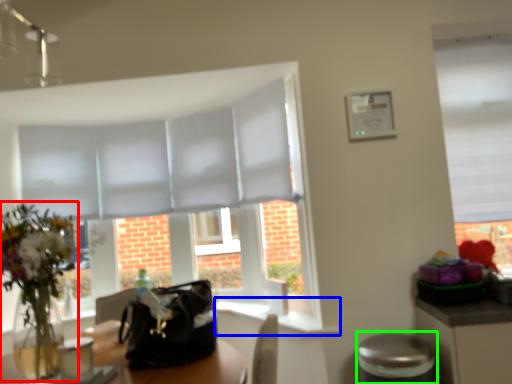
Question: Based on their relative distances, which object is farther from floral arrangement (highlighted by a red box)? Choose from window sill (highlighted by a blue box) and bar stool (highlighted by a green box).

Choices:
 (A) window sill
 (B) bar stool

Answer: (A)